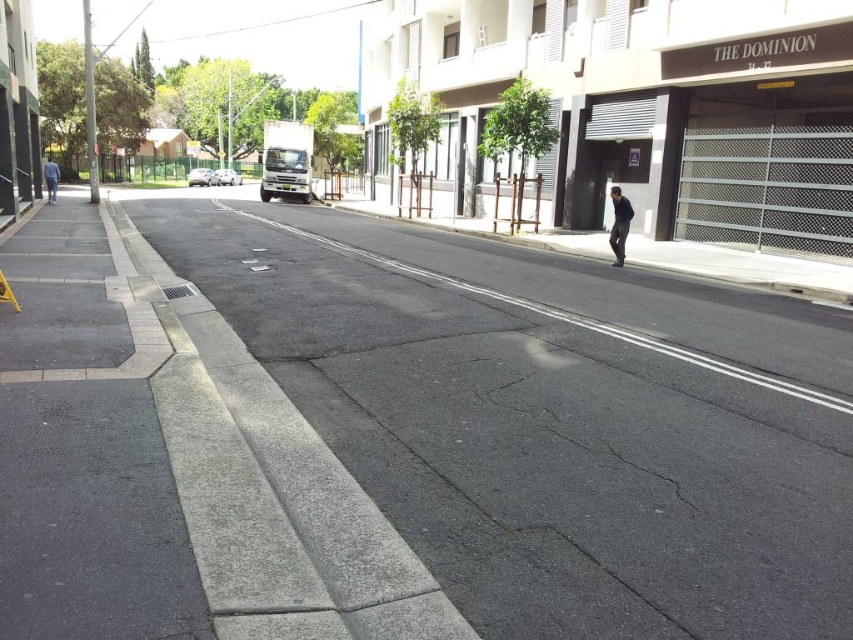
Looking at this image, between dark blue jeans at center-right and silver metallic sedan at center, which one appears on the left side from the viewer's perspective?

Positioned to the left is silver metallic sedan at center.

Which is above, dark blue jeans at center-right or silver metallic sedan at center?

silver metallic sedan at center is above.

This screenshot has width=853, height=640. What do you see at coordinates (619, 225) in the screenshot?
I see `dark blue jeans at center-right` at bounding box center [619, 225].

The width and height of the screenshot is (853, 640). Find the location of `dark blue jeans at center-right`. dark blue jeans at center-right is located at coordinates (619, 225).

Does dark blue jeans at center-right appear on the right side of blue jeans at left?

Yes, dark blue jeans at center-right is to the right of blue jeans at left.

Is dark blue jeans at center-right positioned before blue jeans at left?

Yes.

Is point (619, 202) closer to camera compared to point (48, 157)?

That is True.

Locate an element on the screen. The height and width of the screenshot is (640, 853). dark blue jeans at center-right is located at coordinates (619, 225).

Is gray concrete sidewalk at lower left above gray concrete curb at center?

Indeed, gray concrete sidewalk at lower left is positioned over gray concrete curb at center.

Is point (115, 374) closer to viewer compared to point (231, 353)?

Yes, it is.

Where is `gray concrete sidewalk at lower left`? gray concrete sidewalk at lower left is located at coordinates (85, 445).